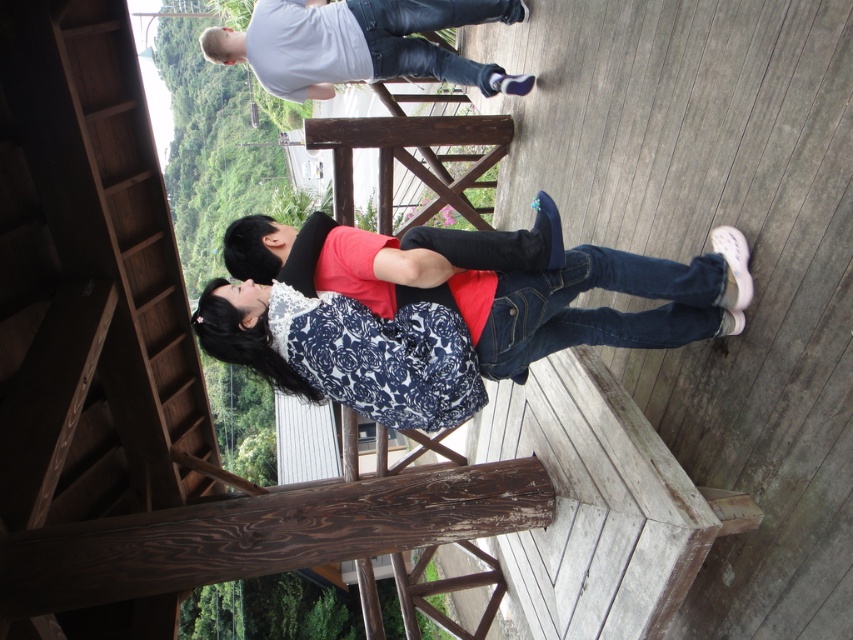
Question: Does floral-patterned sweater at center have a lesser width compared to white matte shirt at upper center?

Choices:
 (A) yes
 (B) no

Answer: (A)

Question: Which of the following is the closest to the observer?

Choices:
 (A) (500, 1)
 (B) (218, 340)

Answer: (B)

Question: Which of the following is the closest to the observer?

Choices:
 (A) white matte shirt at upper center
 (B) floral-patterned sweater at center

Answer: (B)

Question: Does floral-patterned sweater at center have a greater width compared to white matte shirt at upper center?

Choices:
 (A) no
 (B) yes

Answer: (A)

Question: Can you confirm if floral-patterned sweater at center is bigger than white matte shirt at upper center?

Choices:
 (A) yes
 (B) no

Answer: (B)